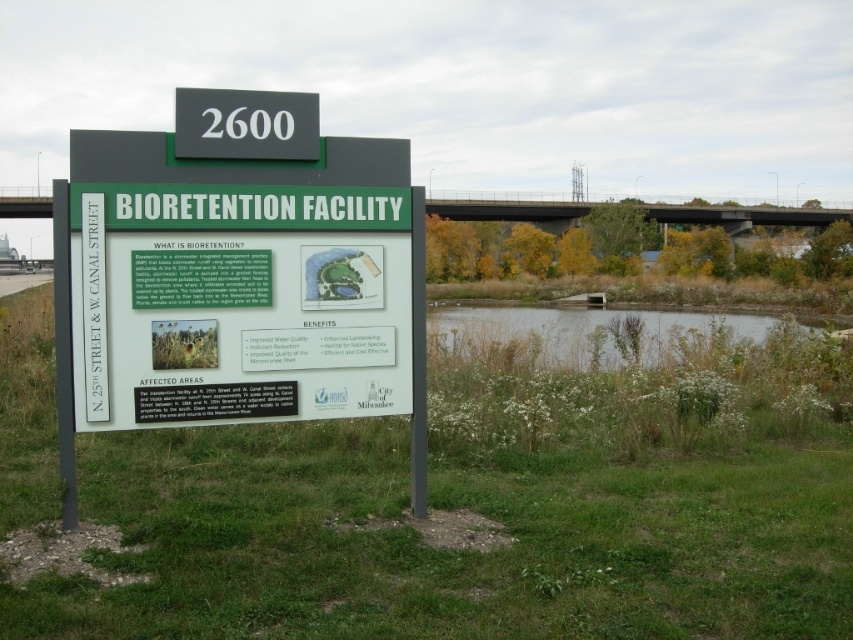
Question: Does green grass at center appear on the right side of green plastic sign at center?

Choices:
 (A) yes
 (B) no

Answer: (B)

Question: Can you confirm if green grass at center is positioned below green plastic sign at center?

Choices:
 (A) no
 (B) yes

Answer: (B)

Question: Which point is farther from the camera taking this photo?

Choices:
 (A) (242, 298)
 (B) (4, 451)

Answer: (B)

Question: Among these objects, which one is farthest from the camera?

Choices:
 (A) green grass at center
 (B) green plastic sign at center

Answer: (B)

Question: Which object appears farthest from the camera in this image?

Choices:
 (A) green grass at center
 (B) green plastic sign at center

Answer: (B)

Question: Does green grass at center appear under green plastic sign at center?

Choices:
 (A) no
 (B) yes

Answer: (B)